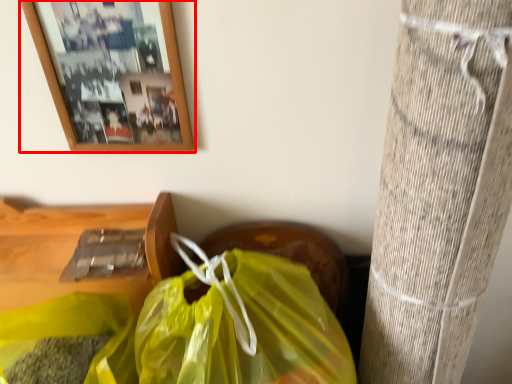
Question: From the image's perspective, what is the correct spatial positioning of picture frame (annotated by the red box) in reference to plastic bag?

Choices:
 (A) below
 (B) above

Answer: (B)